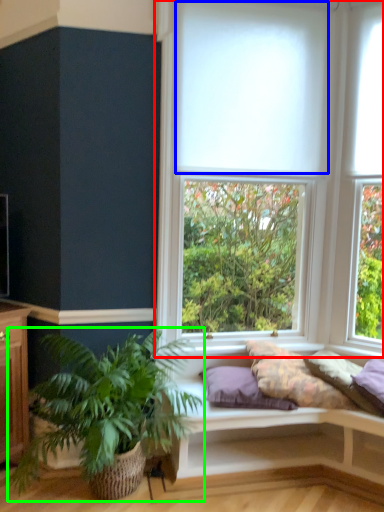
Question: Based on their relative distances, which object is nearer to window (highlighted by a red box)? Choose from blind (highlighted by a blue box) and houseplant (highlighted by a green box).

Choices:
 (A) blind
 (B) houseplant

Answer: (A)